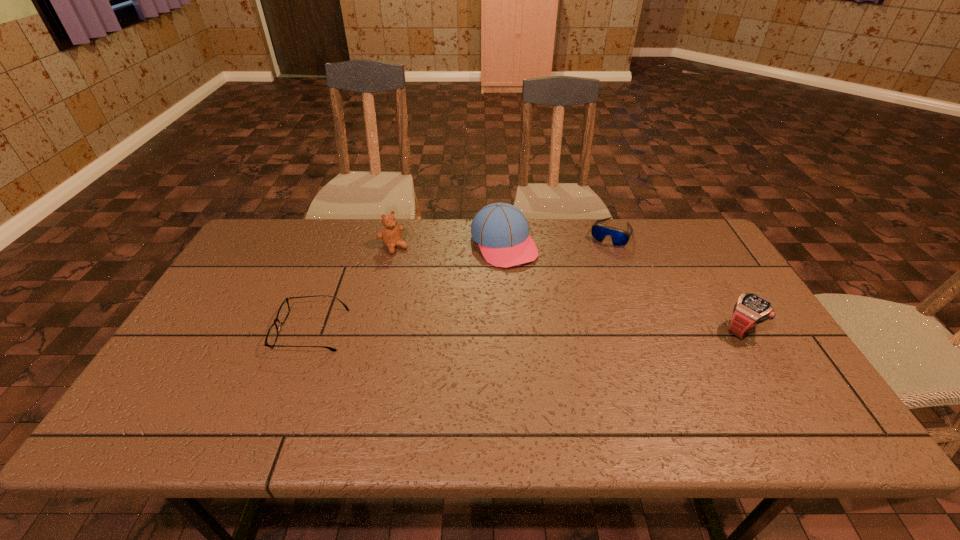
The width and height of the screenshot is (960, 540). I want to click on vacant space on the desktop that is between the leftmost object and the watch and is positioned on the face of the teddy bear, so click(x=468, y=330).

Where is `vacant spot on the desktop that is between the shortest object and the watch and is positioned on the front-facing side of the third object from left to right`? vacant spot on the desktop that is between the shortest object and the watch and is positioned on the front-facing side of the third object from left to right is located at coordinates (564, 329).

I want to click on free space on the desktop that is between the spectacles and the rightmost object and is positioned on the front-facing side of the sunglasses, so click(560, 329).